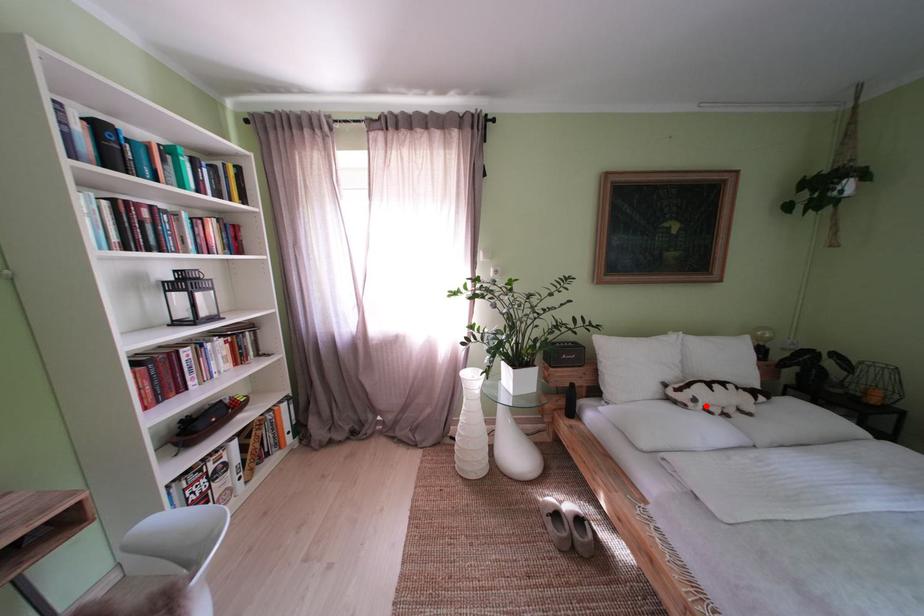
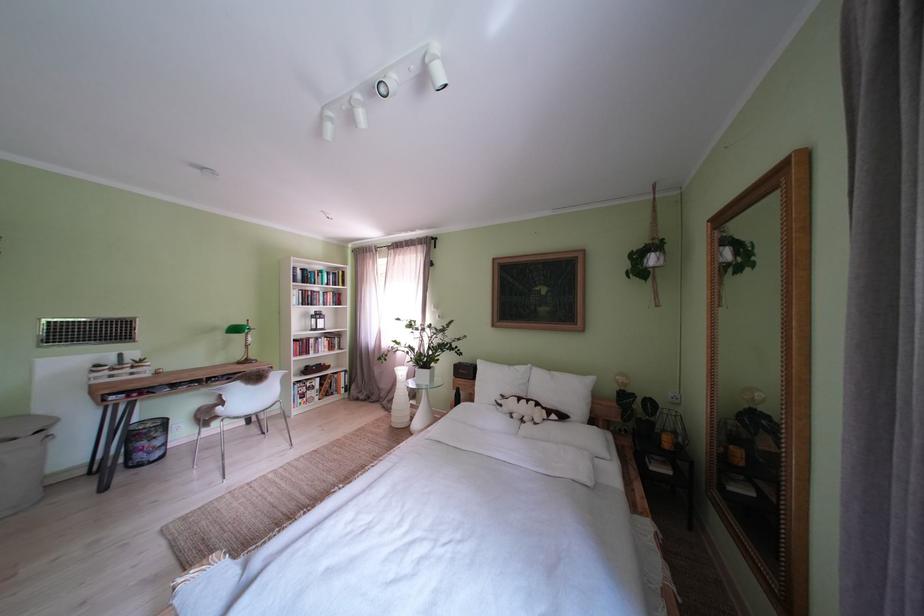
The point at the highlighted location is marked in the first image. Where is the corresponding point in the second image?

(512, 411)